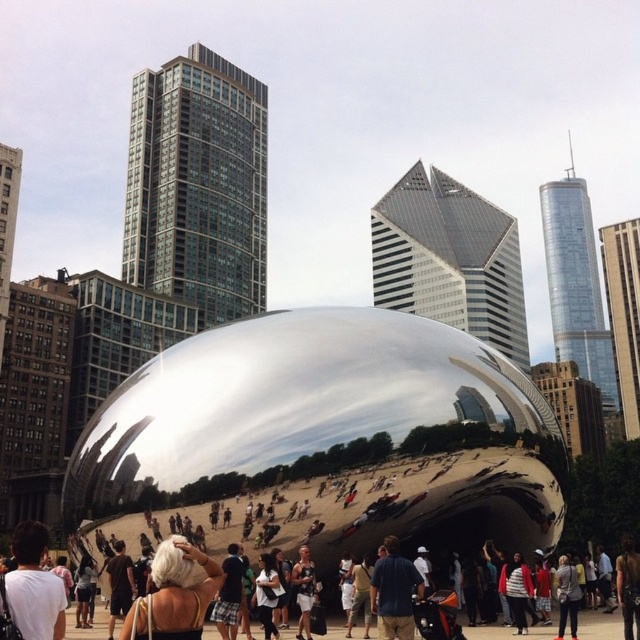
You are standing in the urban scene with the Cloud Gate sculpture. You notice two points marked in the image. Which point, point (180,592) or point (380,637), is closer to you?

Point (180,592) is closer to the viewer than point (380,637).

From the picture: You are a photographer aiming to capture the reflection of the blonde hair at center and the blue fabric shirt at center on the metallic sculpture. Based on their widths, which one would appear wider in the reflection?

The blonde hair at center would appear wider in the reflection since its width surpasses that of the blue fabric shirt at center.

You are a photographer positioned at the center of the scene, aiming to capture the blonde hair at center without including the skyscrapers in the background. Based on their positions, can you adjust your camera angle to achieve this?

The blonde hair at center is located at point (x=173, y=595), which is near the lower part of the scene. By adjusting the camera angle to focus slightly downward, you can frame the blonde hair at center while excluding the taller skyscrapers in the background.